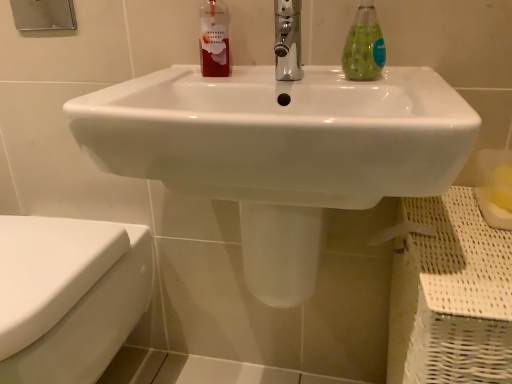
Question: Considering the positions of translucent green liquid at sink right and chrome metallic faucet at center in the image, is translucent green liquid at sink right taller or shorter than chrome metallic faucet at center?

Choices:
 (A) short
 (B) tall

Answer: (B)

Question: From the image's perspective, is translucent green liquid at sink right above or below chrome metallic faucet at center?

Choices:
 (A) below
 (B) above

Answer: (B)

Question: Which of these objects is positioned closest to the matte plastic bottle at upper center?

Choices:
 (A) white glossy sink at center
 (B) chrome metallic faucet at center
 (C) translucent green liquid at sink right
 (D) white glossy toilet at lower left

Answer: (B)

Question: Which object is the farthest from the matte plastic bottle at upper center?

Choices:
 (A) translucent green liquid at sink right
 (B) chrome metallic faucet at center
 (C) white glossy toilet at lower left
 (D) white glossy sink at center

Answer: (C)